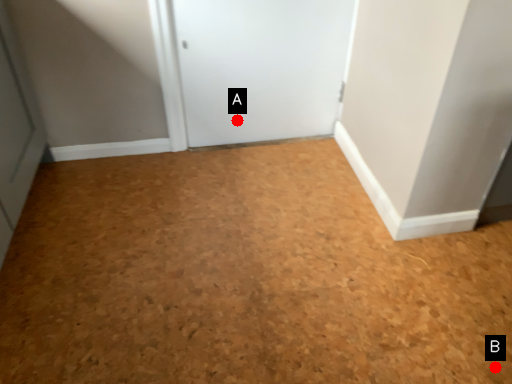
Question: Two points are circled on the image, labeled by A and B beside each circle. Which point is further to the camera?

Choices:
 (A) A is further
 (B) B is further

Answer: (A)